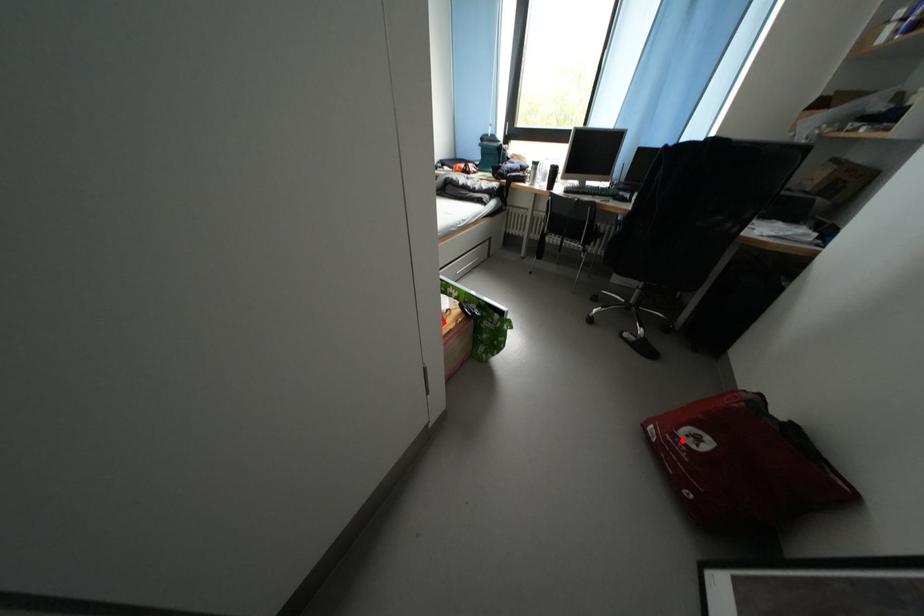
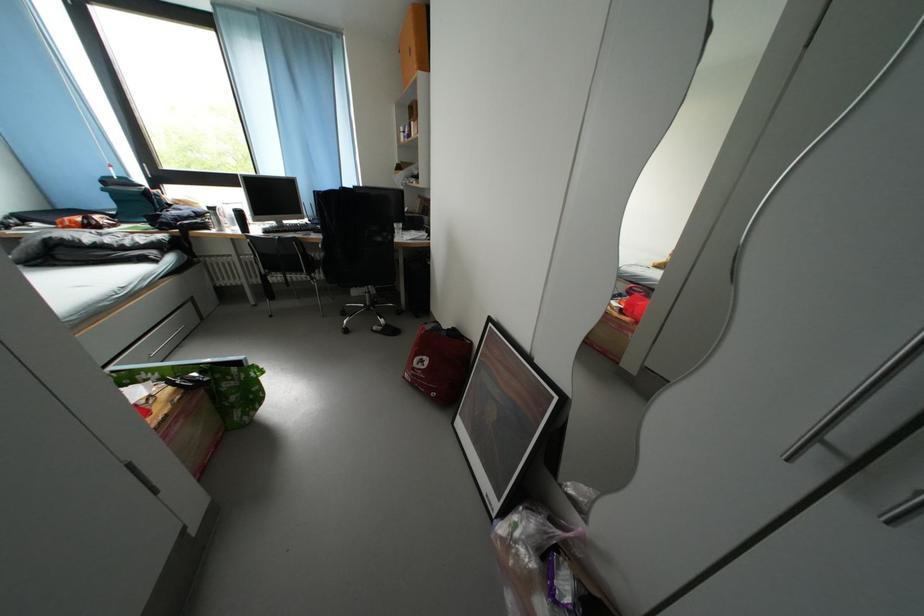
The point at the highlighted location is marked in the first image. Where is the corresponding point in the second image?

(421, 374)